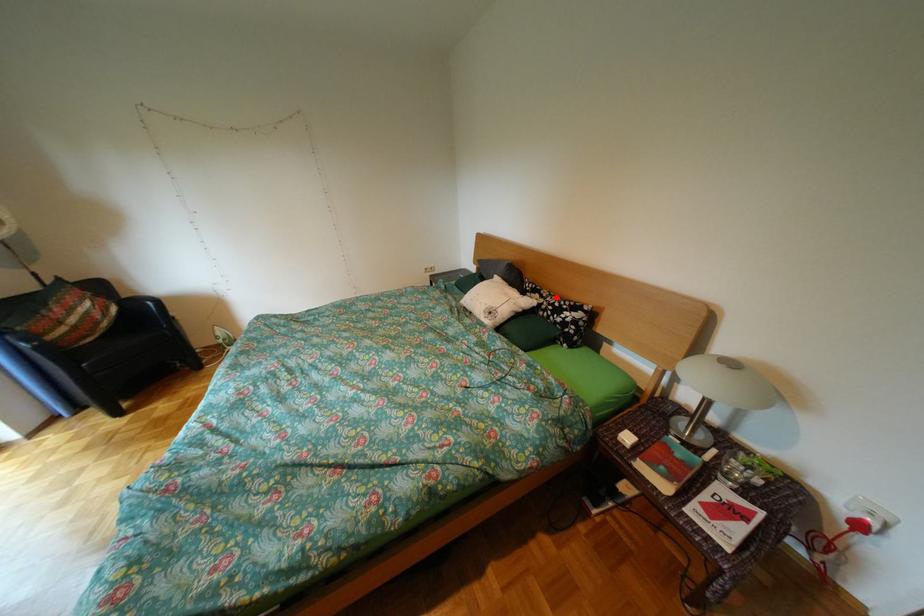
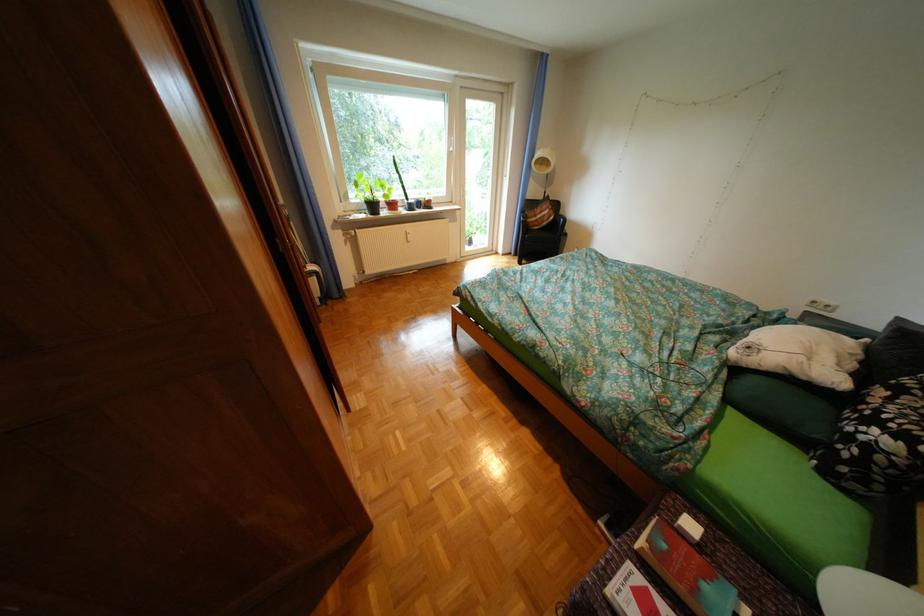
Locate, in the second image, the point that corresponds to the highlighted location in the first image.

(904, 399)